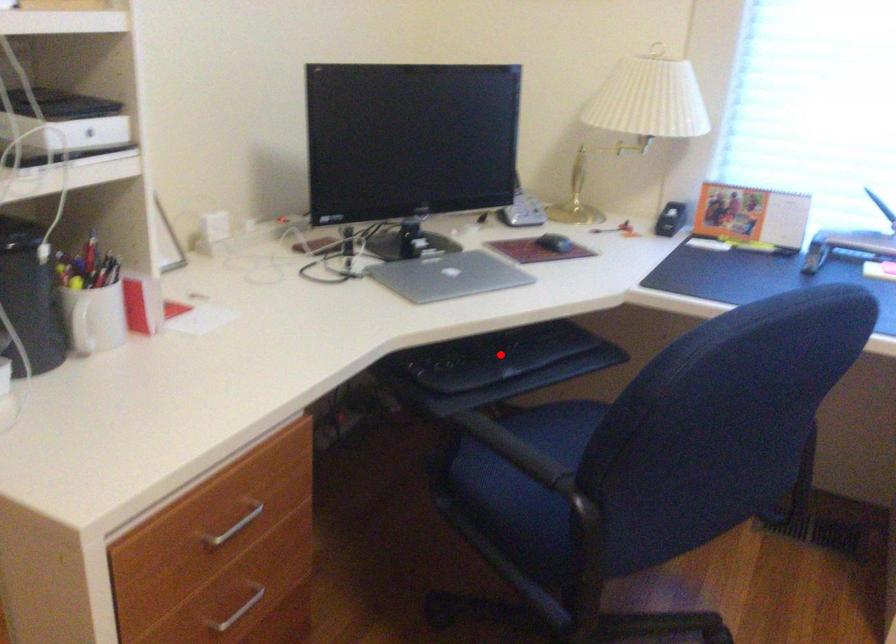
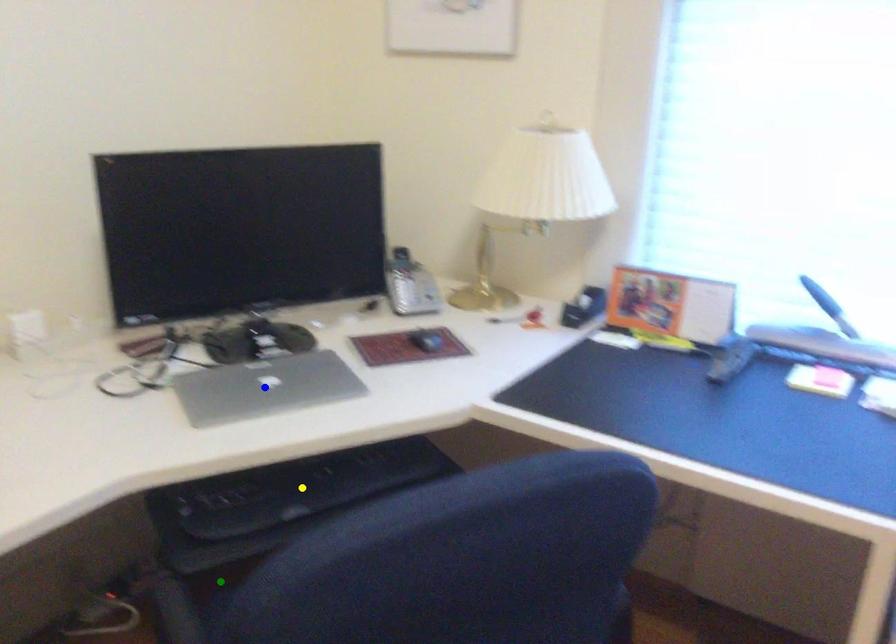
Question: I am providing you with two images of the same scene from different viewpoints. A red point is marked on the first image. You are given multiple points on the second image. Which point in image 2 is actually the same real-world point as the red point in image 1?

Choices:
 (A) blue point
 (B) green point
 (C) yellow point

Answer: (C)